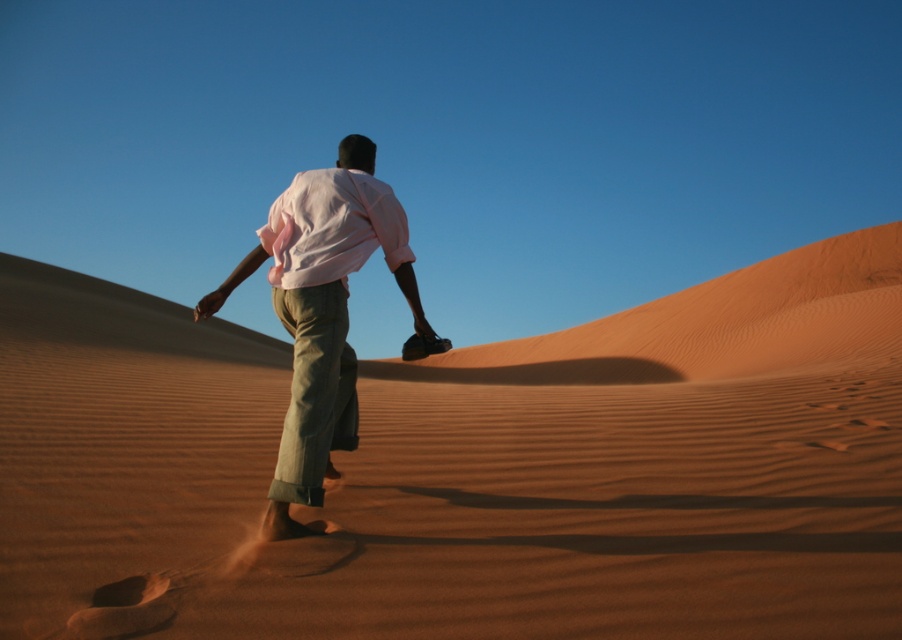
You are a photographer planning to take a portrait of the person wearing the pink cotton shirt at center. Since the smooth sand at center is part of the background, will you need to adjust your camera focus to ensure both the person and the sand details are clear?

The smooth sand at center is larger in size than the pink cotton shirt at center, so adjusting the camera focus to accommodate the larger sand area might help ensure both elements are in focus.

You are a photographer trying to capture the person in the scene. Since the smooth sand at center and the pink cotton shirt at center are both at the center, which one is closer to the camera?

The smooth sand at center is positioned under the pink cotton shirt at center, so the pink cotton shirt at center is closer to the camera.